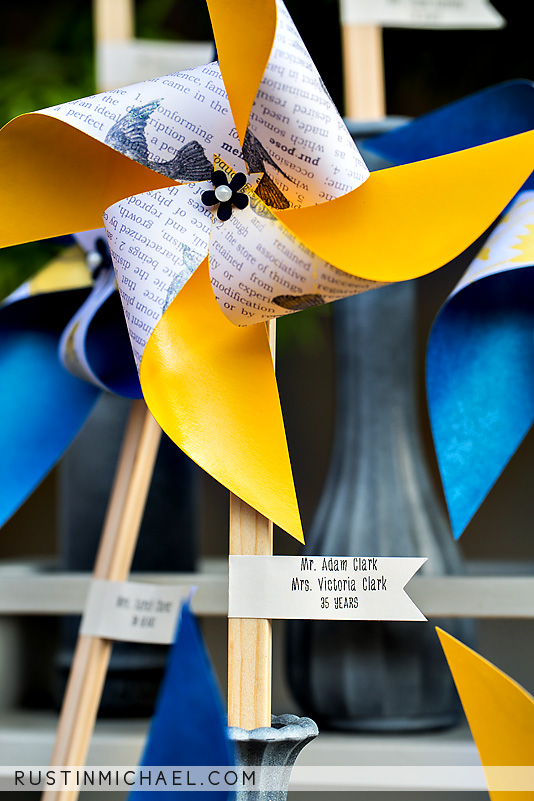
Identify the location of vases. (381, 436), (93, 455), (259, 747).